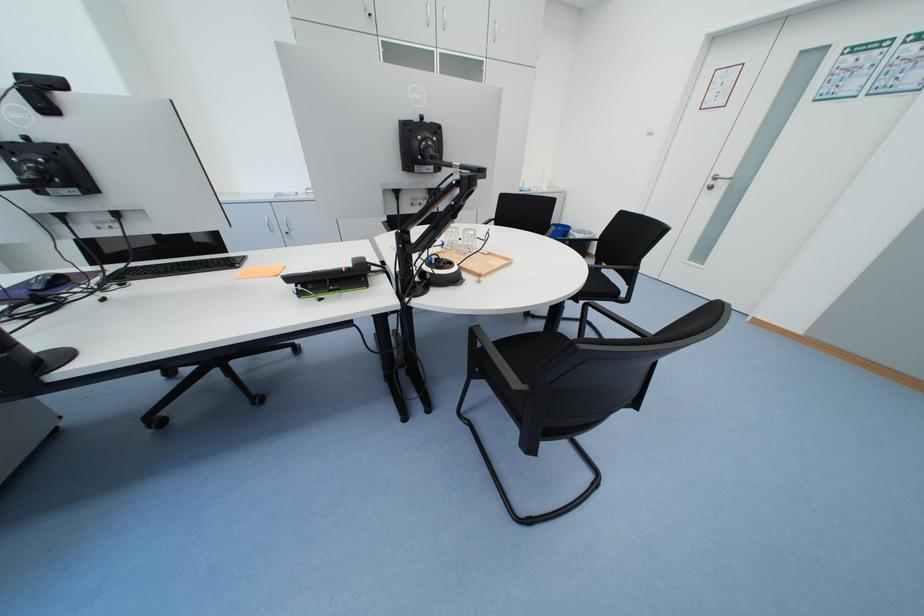
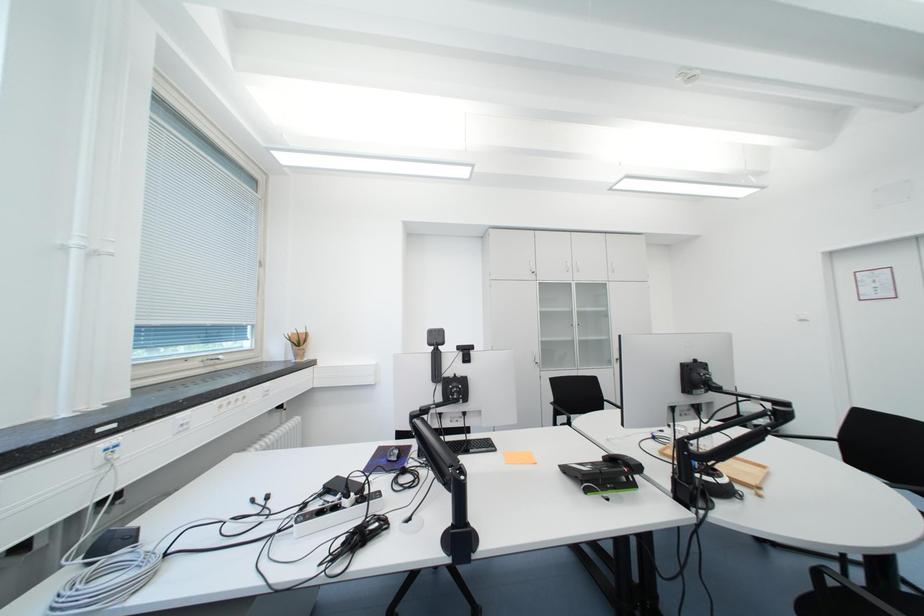
Based on the continuous images, in which direction is the camera rotating?

The camera's rotation is toward left-up.